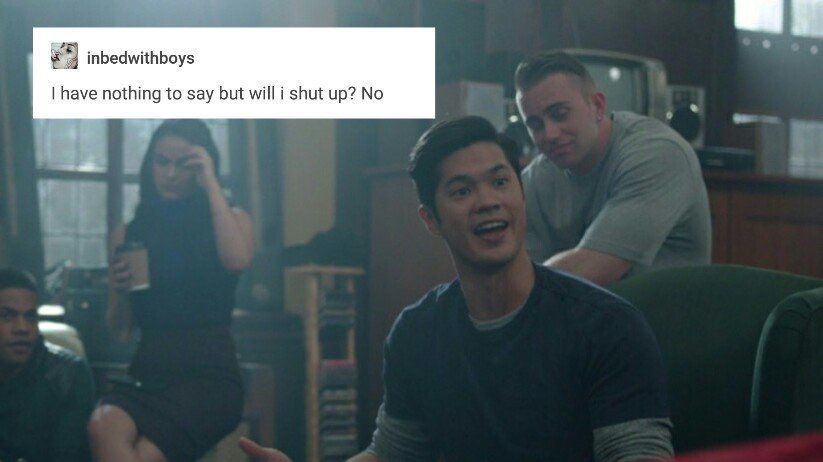
In order to click on possible curtains in this screenshot , I will do `click(20, 183)`, `click(266, 185)`.